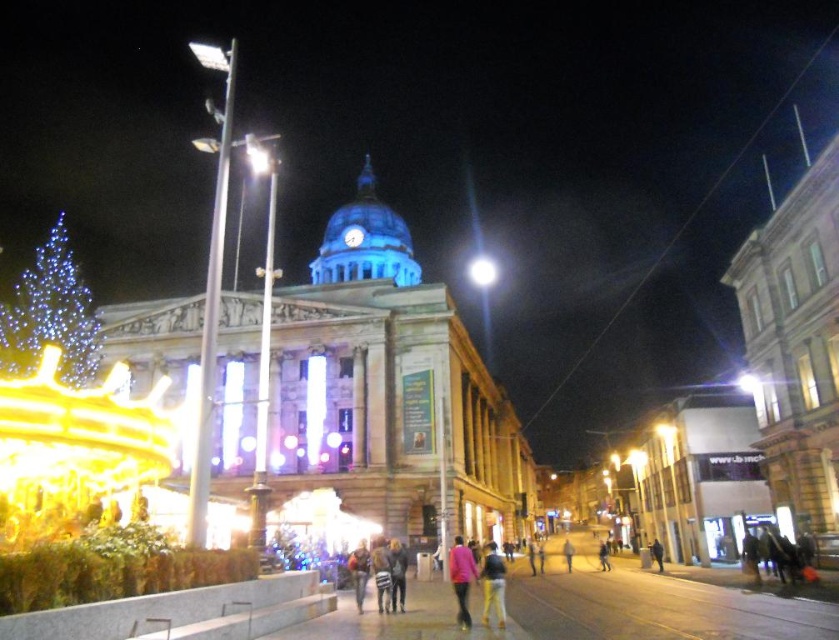
You are attending a night event at the city square and notice a pink matte jacket at center and a bright white light at center. Which object is positioned lower in the scene?

The pink matte jacket at center is located below the bright white light at center, so it is positioned lower in the scene.

You are standing in front of the grand classical building with a blue dome. You want to take a photo of the blue led lights at left from a distance that is exactly 240 feet away. Is this possible?

The blue led lights at left is 240.25 feet from camera, so if you position yourself exactly at that distance, you can take the photo as desired.

You are standing in the city square and see the pink matte jacket at center and the bright white light at center. Which object is nearer to you?

The pink matte jacket at center is closer to the viewer than the bright white light at center.